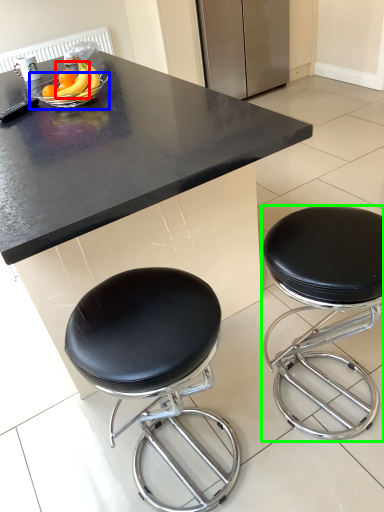
Question: Estimate the real-world distances between objects in this image. Which object is farther from banana (highlighted by a red box), bowl (highlighted by a blue box) or stool (highlighted by a green box)?

Choices:
 (A) bowl
 (B) stool

Answer: (B)